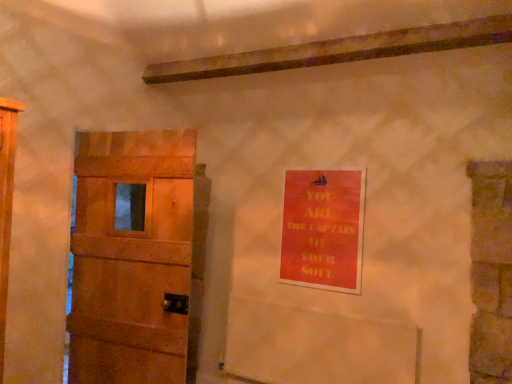
The image size is (512, 384). I want to click on wooden door at left, so click(132, 257).

The image size is (512, 384). What do you see at coordinates (132, 257) in the screenshot?
I see `wooden door at left` at bounding box center [132, 257].

At what (x,y) coordinates should I click in order to perform the action: click on orange matte poster at upper right. Please return your answer as a coordinate pair (x, y). The height and width of the screenshot is (384, 512). Looking at the image, I should click on (323, 229).

Describe the element at coordinates (323, 229) in the screenshot. I see `orange matte poster at upper right` at that location.

Identify the location of wooden door at left. Image resolution: width=512 pixels, height=384 pixels. (132, 257).

Considering the relative positions of wooden door at left and orange matte poster at upper right in the image provided, is wooden door at left to the left or to the right of orange matte poster at upper right?

wooden door at left is positioned on orange matte poster at upper right's left side.

Considering the positions of objects wooden door at left and orange matte poster at upper right in the image provided, who is in front, wooden door at left or orange matte poster at upper right?

wooden door at left.

Considering the positions of points (136, 334) and (335, 225), is point (136, 334) farther from camera compared to point (335, 225)?

No, it is not.

From the image's perspective, which one is positioned higher, wooden door at left or orange matte poster at upper right?

orange matte poster at upper right.

From a real-world perspective, is wooden door at left positioned under orange matte poster at upper right based on gravity?

Yes.

In terms of width, does wooden door at left look wider or thinner when compared to orange matte poster at upper right?

In the image, wooden door at left appears to be wider than orange matte poster at upper right.

Is wooden door at left taller than orange matte poster at upper right?

Correct, wooden door at left is much taller as orange matte poster at upper right.

Can you confirm if wooden door at left is bigger than orange matte poster at upper right?

Indeed, wooden door at left has a larger size compared to orange matte poster at upper right.

Would you say orange matte poster at upper right is part of wooden door at left's contents?

Definitely not — orange matte poster at upper right is not inside wooden door at left.

Is wooden door at left far from orange matte poster at upper right?

Yes, wooden door at left is far from orange matte poster at upper right.

Is wooden door at left positioned with its back to orange matte poster at upper right?

That's not correct — wooden door at left is not looking away from orange matte poster at upper right.

This screenshot has height=384, width=512. In order to click on warning sign above the wooden door at left (from a real-world perspective) in this screenshot , I will do `click(323, 229)`.

Is orange matte poster at upper right to the right of wooden door at left from the viewer's perspective?

Indeed, orange matte poster at upper right is positioned on the right side of wooden door at left.

Relative to wooden door at left, is orange matte poster at upper right in front or behind?

Clearly, orange matte poster at upper right is behind wooden door at left.

Is point (336, 265) more distant than point (126, 350)?

Yes, point (336, 265) is farther from viewer.

From the image's perspective, which one is positioned higher, orange matte poster at upper right or wooden door at left?

orange matte poster at upper right appears higher in the image.

From a real-world perspective, between orange matte poster at upper right and wooden door at left, who is vertically lower?

From a 3D spatial view, wooden door at left is below.

Can you confirm if orange matte poster at upper right is wider than wooden door at left?

No.

Considering the sizes of orange matte poster at upper right and wooden door at left in the image, is orange matte poster at upper right taller or shorter than wooden door at left?

Considering their sizes, orange matte poster at upper right has less height than wooden door at left.

Which of these two, orange matte poster at upper right or wooden door at left, is smaller?

Smaller between the two is orange matte poster at upper right.

Is orange matte poster at upper right inside the boundaries of wooden door at left, or outside?

orange matte poster at upper right is not enclosed by wooden door at left.

Are orange matte poster at upper right and wooden door at left far apart?

orange matte poster at upper right is positioned a significant distance from wooden door at left.

Could you tell me if orange matte poster at upper right is turned towards wooden door at left?

No, orange matte poster at upper right is not facing towards wooden door at left.

At what (x,y) coordinates should I click in order to perform the action: click on warning sign behind the wooden door at left. Please return your answer as a coordinate pair (x, y). Looking at the image, I should click on (323, 229).

Where is `door that appears on the left of orange matte poster at upper right`? door that appears on the left of orange matte poster at upper right is located at coordinates point(132,257).

Where is `warning sign located above the wooden door at left (from the image's perspective)`? Image resolution: width=512 pixels, height=384 pixels. warning sign located above the wooden door at left (from the image's perspective) is located at coordinates (323, 229).